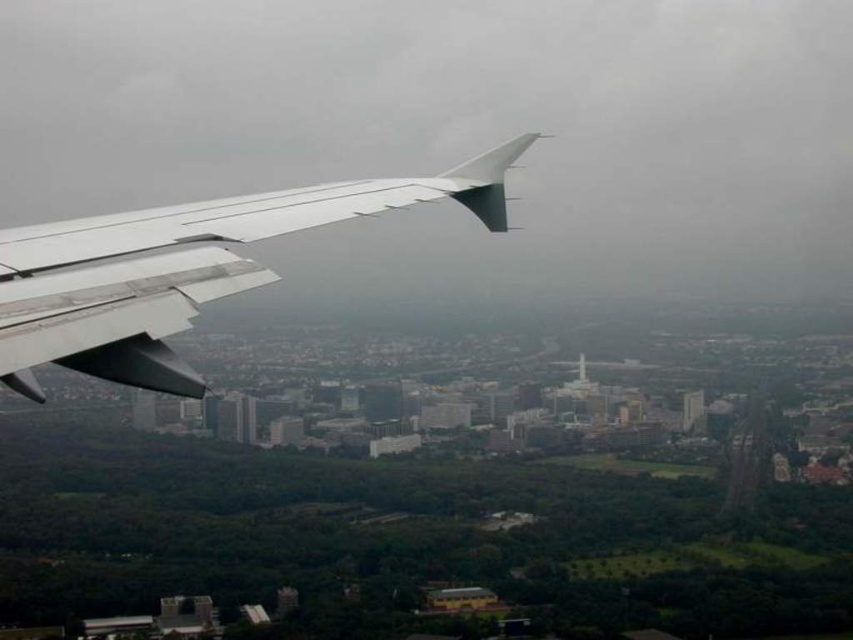
Is white matte wing at left thinner than metallic silver wing at left?

No, white matte wing at left is not thinner than metallic silver wing at left.

Based on the photo, can you confirm if white matte wing at left is positioned to the left of metallic silver wing at left?

Incorrect, white matte wing at left is not on the left side of metallic silver wing at left.

The image size is (853, 640). In order to click on white matte wing at left in this screenshot , I will do `click(459, 134)`.